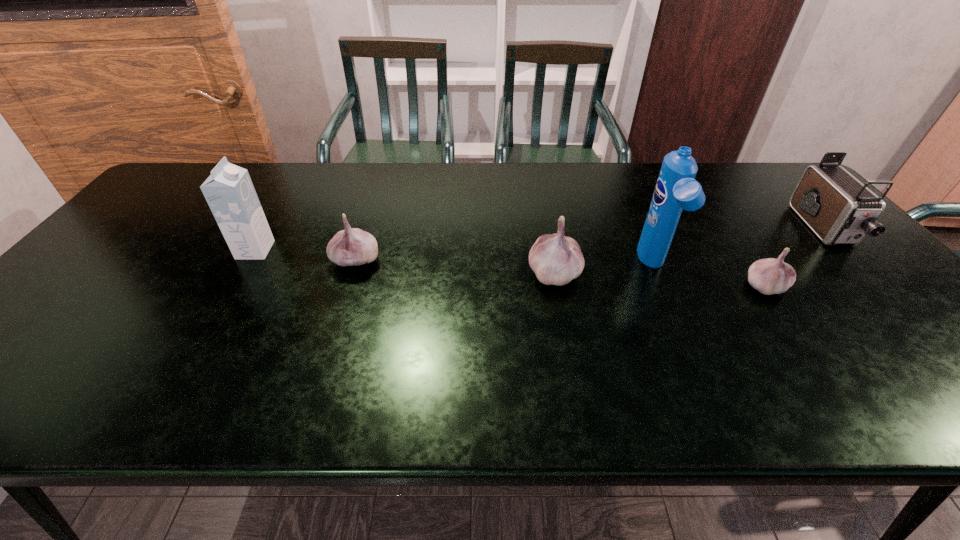
Where is `free space located 0.090m on the back of the second shortest object`? This screenshot has height=540, width=960. free space located 0.090m on the back of the second shortest object is located at coordinates (367, 226).

The image size is (960, 540). Identify the location of free space located 0.230m on the left of the second garlic from right to left. (437, 273).

Where is `vacant region located 0.140m on the right of the shortest object`? The image size is (960, 540). vacant region located 0.140m on the right of the shortest object is located at coordinates (842, 286).

Find the location of a particular element. This screenshot has width=960, height=540. vacant space located 0.140m at the lens of the camcorder is located at coordinates (886, 295).

You are a GUI agent. You are given a task and a screenshot of the screen. Output one action in this format:
    pyautogui.click(x=<x>, y=<y>)
    Task: Click on the blank space located 0.360m on the front label of the fifth shortest object
    Image resolution: width=960 pixels, height=540 pixels.
    Given the screenshot: What is the action you would take?
    pyautogui.click(x=403, y=250)

Find the location of a particular element. free space located 0.370m on the left of the shampoo is located at coordinates (498, 267).

Locate an element on the screen. The width and height of the screenshot is (960, 540). object present at the right edge is located at coordinates (837, 207).

Locate an element on the screen. vacant space at the far edge of the desktop is located at coordinates (561, 181).

Identify the location of vacant area at the near edge. Image resolution: width=960 pixels, height=540 pixels. (588, 346).

Find the location of `vacant region at the right edge of the desktop`. vacant region at the right edge of the desktop is located at coordinates (878, 304).